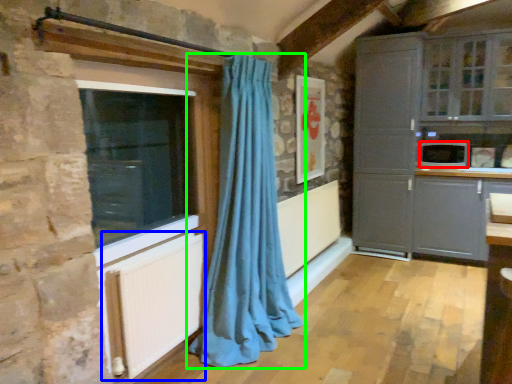
Question: Considering the real-world distances, which object is closest to appliance (highlighted by a red box)? radiator (highlighted by a blue box) or curtain (highlighted by a green box).

Choices:
 (A) radiator
 (B) curtain

Answer: (B)